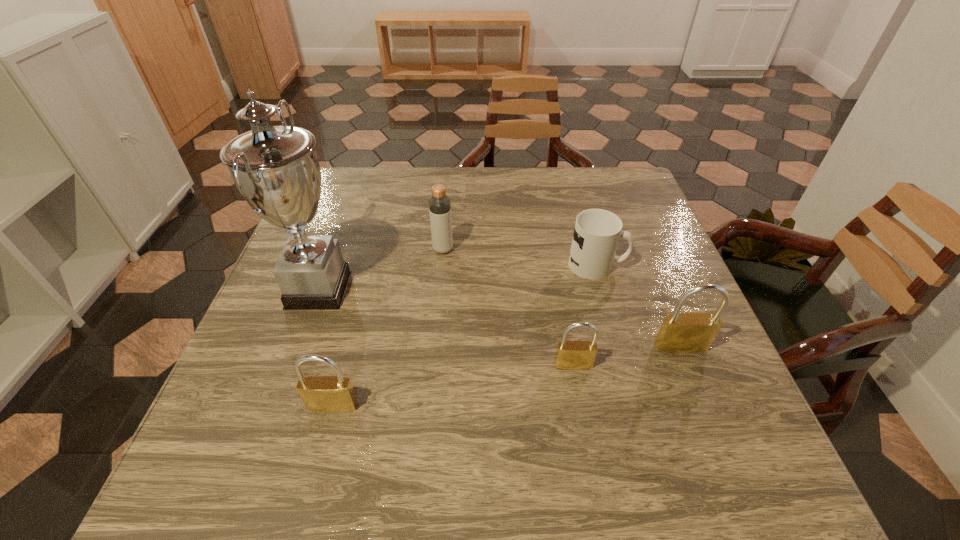
In order to click on blank region between the mug and the tallest object in this screenshot , I will do `click(458, 278)`.

I want to click on free spot between the nearest object and the fourth object from right to left, so click(x=388, y=328).

This screenshot has width=960, height=540. I want to click on free space between the nearest object and the tallest object, so click(325, 348).

Identify the location of object that is the closest to the mug. (691, 332).

Where is `object that stands as the third closest to the mug`? object that stands as the third closest to the mug is located at coordinates (439, 203).

Where is `padlock that is the second closest to the second nearest object`? padlock that is the second closest to the second nearest object is located at coordinates (327, 394).

Locate an element on the screen. This screenshot has width=960, height=540. padlock identified as the second closest to the second nearest object is located at coordinates (327, 394).

Identify the location of vacant region that satisfies the following two spatial constraints: 1. on the handle side of the mug; 2. on the front-facing side of the second farthest padlock. coord(625,365).

Find the location of `free spot that satisfies the following two spatial constraints: 1. on the handle side of the mug; 2. on the front-facing side of the nearest padlock`. free spot that satisfies the following two spatial constraints: 1. on the handle side of the mug; 2. on the front-facing side of the nearest padlock is located at coordinates (636, 406).